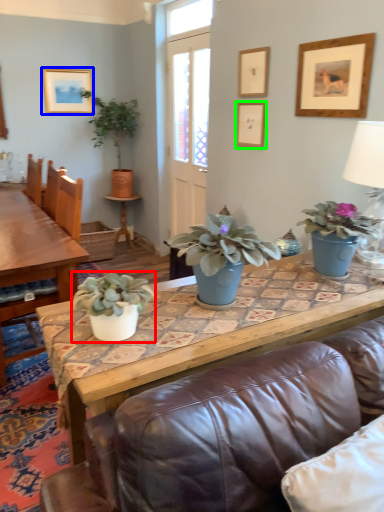
Question: Which object is positioned closest to houseplant (highlighted by a red box)? Select from picture frame (highlighted by a blue box) and picture frame (highlighted by a green box).

Choices:
 (A) picture frame
 (B) picture frame

Answer: (B)